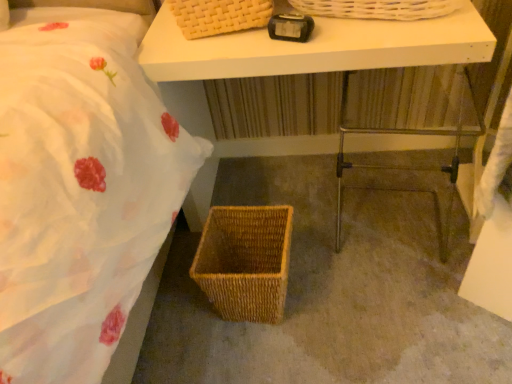
Question: Relative to white matte table at upper center, is brown woven basket at lower center in front or behind?

Choices:
 (A) behind
 (B) front

Answer: (A)

Question: In terms of width, does brown woven basket at lower center look wider or thinner when compared to white matte table at upper center?

Choices:
 (A) thin
 (B) wide

Answer: (B)

Question: Based on their relative distances, which object is farther from the metallic silver step stool at lower right?

Choices:
 (A) woven brown picnic basket at lower center
 (B) black plastic alarm clock at upper center
 (C) white matte table at upper center
 (D) brown woven basket at lower center

Answer: (B)

Question: Which of these objects is positioned closest to the metallic silver step stool at lower right?

Choices:
 (A) woven brown picnic basket at lower center
 (B) black plastic alarm clock at upper center
 (C) brown woven basket at lower center
 (D) white matte table at upper center

Answer: (D)